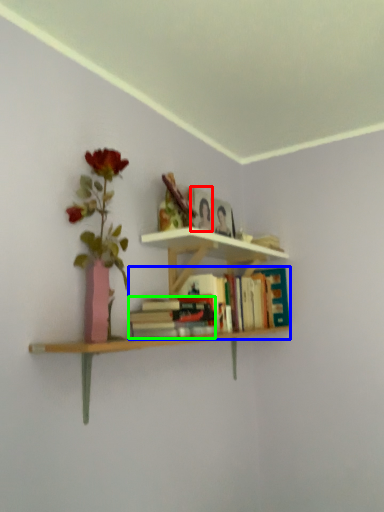
Question: Which is nearer to the paperback book (highlighted by a red box)? book (highlighted by a blue box) or book (highlighted by a green box).

Choices:
 (A) book
 (B) book

Answer: (A)